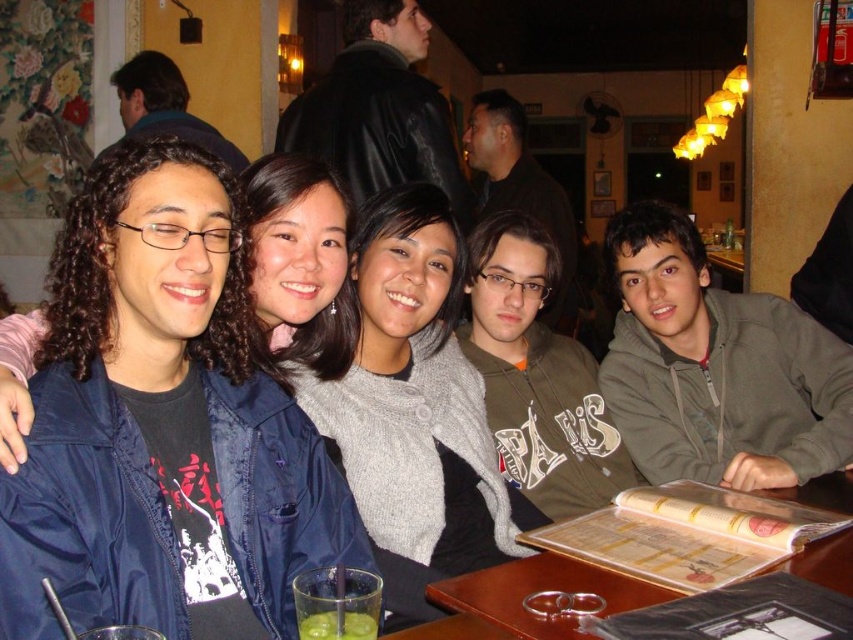
Can you confirm if gray fleece hoodie at right is taller than green matte glass at lower center?

Indeed, gray fleece hoodie at right has a greater height compared to green matte glass at lower center.

Between point (660, 248) and point (363, 612), which one is positioned behind?

Point (660, 248)

You are a GUI agent. You are given a task and a screenshot of the screen. Output one action in this format:
    pyautogui.click(x=<x>, y=<y>)
    Task: Click on the gray fleece hoodie at right
    This screenshot has height=640, width=853.
    Given the screenshot: What is the action you would take?
    pyautogui.click(x=717, y=368)

Does point (410, 614) come in front of point (294, 593)?

No, it is behind (294, 593).

The height and width of the screenshot is (640, 853). Identify the location of gray wool sweater at center. (415, 406).

At what (x,y) coordinates should I click in order to perform the action: click on gray wool sweater at center. Please return your answer as a coordinate pair (x, y). Looking at the image, I should click on (415, 406).

This screenshot has width=853, height=640. Find the location of `gray wool sweater at center`. gray wool sweater at center is located at coordinates (415, 406).

Does point (184, 236) come farther from viewer compared to point (357, 589)?

That is True.

Is matte gray sweater at center wider than green translucent glass at lower center?

Correct, the width of matte gray sweater at center exceeds that of green translucent glass at lower center.

I want to click on matte gray sweater at center, so click(x=161, y=426).